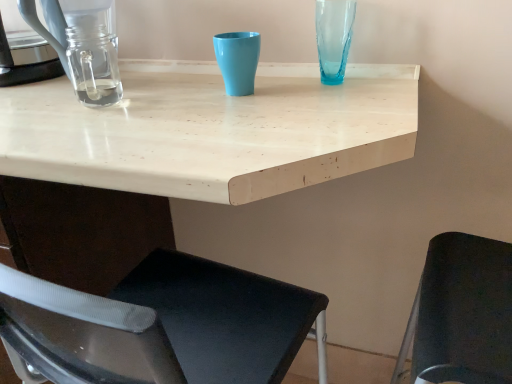
In order to face matte plastic cup at center, should I rotate leftwards or rightwards?

A 1.162 degree turn to the left will do.

Describe the element at coordinates (237, 60) in the screenshot. I see `matte plastic cup at center` at that location.

What do you see at coordinates (334, 37) in the screenshot? I see `translucent blue glass vase at upper right` at bounding box center [334, 37].

In order to face clear glass coffeepot at left, should I rotate leftwards or rightwards?

You should rotate left by 22.597 degrees.

Where is `matte plastic cup at center`? This screenshot has width=512, height=384. matte plastic cup at center is located at coordinates (237, 60).

Is black fabric chair at lower right next to white matte table at center and touching it?

No, black fabric chair at lower right is not next to white matte table at center.

Consider the image. Can you confirm if black fabric chair at lower right is shorter than white matte table at center?

Yes, black fabric chair at lower right is shorter than white matte table at center.

Is black fabric chair at lower right positioned with its back to white matte table at center?

black fabric chair at lower right does not have its back to white matte table at center.

In the image, is black fabric chair at lower right on the left side or the right side of matte plastic cup at center?

Clearly, black fabric chair at lower right is on the right of matte plastic cup at center in the image.

Based on the photo, which of these two, black fabric chair at lower right or matte plastic cup at center, stands shorter?

matte plastic cup at center is shorter.

Is black fabric chair at lower right facing away from matte plastic cup at center?

No, black fabric chair at lower right is not facing away from matte plastic cup at center.

From the image's perspective, relative to white matte table at center, is translucent blue glass vase at upper right above or below?

From the image's perspective, translucent blue glass vase at upper right appears above white matte table at center.

Based on the photo, is translucent blue glass vase at upper right taller than white matte table at center?

Incorrect, the height of translucent blue glass vase at upper right is not larger of that of white matte table at center.

From a real-world perspective, is translucent blue glass vase at upper right physically above white matte table at center?

Correct, in the physical world, translucent blue glass vase at upper right is higher than white matte table at center.

Would you say translucent blue glass vase at upper right is outside white matte table at center?

translucent blue glass vase at upper right lies outside white matte table at center's area.

From the image's perspective, between black fabric chair at lower right and clear glass jar at left, which one is located above?

clear glass jar at left.

This screenshot has width=512, height=384. In order to click on chair in front of the clear glass jar at left in this screenshot , I will do `click(462, 313)`.

Consider the image. Considering the relative sizes of black fabric chair at lower right and clear glass jar at left in the image provided, is black fabric chair at lower right smaller than clear glass jar at left?

No, black fabric chair at lower right is not smaller than clear glass jar at left.

Considering the positions of point (336, 13) and point (32, 1), is point (336, 13) closer or farther from the camera than point (32, 1)?

Point (336, 13) is positioned farther from the camera compared to point (32, 1).

At what (x,y) coordinates should I click in order to perform the action: click on glass vase below the clear glass coffeepot at left (from the image's perspective). Please return your answer as a coordinate pair (x, y). This screenshot has height=384, width=512. Looking at the image, I should click on (334, 37).

In the scene shown: Can you confirm if translucent blue glass vase at upper right is thinner than clear glass coffeepot at left?

Yes, translucent blue glass vase at upper right is thinner than clear glass coffeepot at left.

Who is shorter, translucent blue glass vase at upper right or clear glass coffeepot at left?

With less height is translucent blue glass vase at upper right.

Measure the distance between black fabric chair at lower right and translucent blue glass vase at upper right.

black fabric chair at lower right is 17.88 inches away from translucent blue glass vase at upper right.

How many degrees apart are the facing directions of black fabric chair at lower right and translucent blue glass vase at upper right?

95.8 degrees separate the facing orientations of black fabric chair at lower right and translucent blue glass vase at upper right.

Considering the sizes of black fabric chair at lower right and translucent blue glass vase at upper right in the image, is black fabric chair at lower right bigger or smaller than translucent blue glass vase at upper right?

Clearly, black fabric chair at lower right is larger in size than translucent blue glass vase at upper right.

Looking at this image, from a real-world perspective, is black fabric chair at lower right beneath translucent blue glass vase at upper right?

Yes, from a real-world perspective, black fabric chair at lower right is under translucent blue glass vase at upper right.

Does clear glass jar at left touch clear glass coffeepot at left?

clear glass jar at left and clear glass coffeepot at left are not in contact.

Which is in front, point (0, 36) or point (30, 4)?

The point (30, 4) is more forward.

Would you say clear glass jar at left is to the left or to the right of clear glass coffeepot at left in the picture?

Based on their positions, clear glass jar at left is located to the left of clear glass coffeepot at left.

The image size is (512, 384). Identify the location of chair behind the white matte table at center. (462, 313).

You are a GUI agent. You are given a task and a screenshot of the screen. Output one action in this format:
    pyautogui.click(x=<x>, y=<y>)
    Task: Click on the chair below the matte plastic cup at center (from a real-world perspective)
    
    Given the screenshot: What is the action you would take?
    pyautogui.click(x=462, y=313)

From the image, which object appears to be farther from translucent blue glass vase at upper right, white matte table at center or matte plastic cup at center?

Based on the image, white matte table at center appears to be further to translucent blue glass vase at upper right.

From the image, which object appears to be farther from clear glass coffeepot at left, clear glass jar at left or translucent blue glass vase at upper right?

translucent blue glass vase at upper right is positioned further to the anchor clear glass coffeepot at left.

When comparing their distances from matte plastic cup at center, does white matte table at center or black fabric chair at lower right seem further?

black fabric chair at lower right lies further to matte plastic cup at center than the other object.

Looking at the image, which one is located closer to matte plastic cup at center, clear glass jar at left or translucent blue glass vase at upper right?

Based on the image, translucent blue glass vase at upper right appears to be nearer to matte plastic cup at center.

Which object lies further to the anchor point clear glass coffeepot at left, clear glass jar at left or white matte table at center?

Among the two, white matte table at center is located further to clear glass coffeepot at left.

Based on the photo, which object lies nearer to the anchor point matte plastic cup at center, translucent blue glass vase at upper right or white matte table at center?

translucent blue glass vase at upper right is positioned closer to the anchor matte plastic cup at center.

Based on the photo, which object lies further to the anchor point translucent blue glass vase at upper right, clear glass coffeepot at left or white matte table at center?

clear glass coffeepot at left lies further to translucent blue glass vase at upper right than the other object.

When comparing their distances from black fabric chair at lower right, does matte plastic cup at center or white matte table at center seem further?

matte plastic cup at center is positioned further to the anchor black fabric chair at lower right.

Locate an element on the screen. This screenshot has width=512, height=384. table situated between clear glass jar at left and black fabric chair at lower right from left to right is located at coordinates (205, 139).

Find the location of a particular element. turquoise that lies between translucent blue glass vase at upper right and white matte table at center from top to bottom is located at coordinates (237, 60).

Where is `glass vase that lies between clear glass coffeepot at left and white matte table at center from top to bottom`? The width and height of the screenshot is (512, 384). glass vase that lies between clear glass coffeepot at left and white matte table at center from top to bottom is located at coordinates (334, 37).

This screenshot has height=384, width=512. Identify the location of turquoise between clear glass coffeepot at left and translucent blue glass vase at upper right. (237, 60).